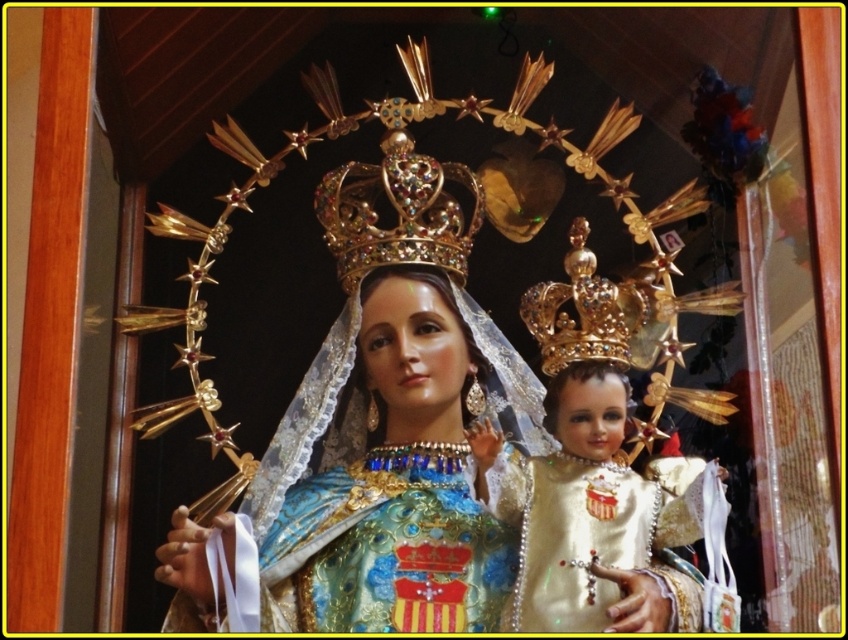
You are an art conservator examining the religious icon. You notice two points of interest marked on the image at coordinates point (x=336, y=246) and point (x=548, y=298). Which point is closer to you as you view the icon?

Point (x=336, y=246) is closer to you than point (x=548, y=298) because it is further to the viewer.

You are an art conservator examining the religious icon. You need to locate the gold glossy crown at center. What are its coordinates?

The gold glossy crown at center is located at coordinates point [579,464].

You are an art conservator examining the religious icon. You need to locate a specific point at coordinates point (395, 212). Where is this point located on the icon?

The point (395, 212) is located on the gold jeweled crown at center.